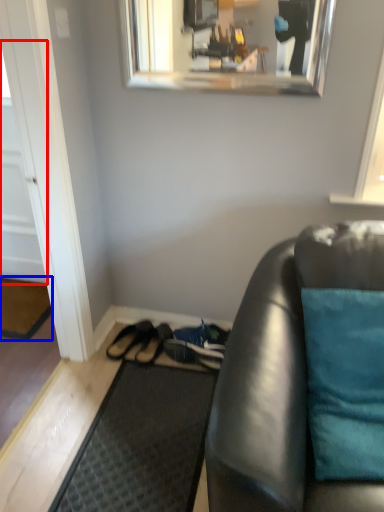
Question: Which of the following is the farthest to the observer, door (highlighted by a red box) or doormat (highlighted by a blue box)?

Choices:
 (A) door
 (B) doormat

Answer: (B)